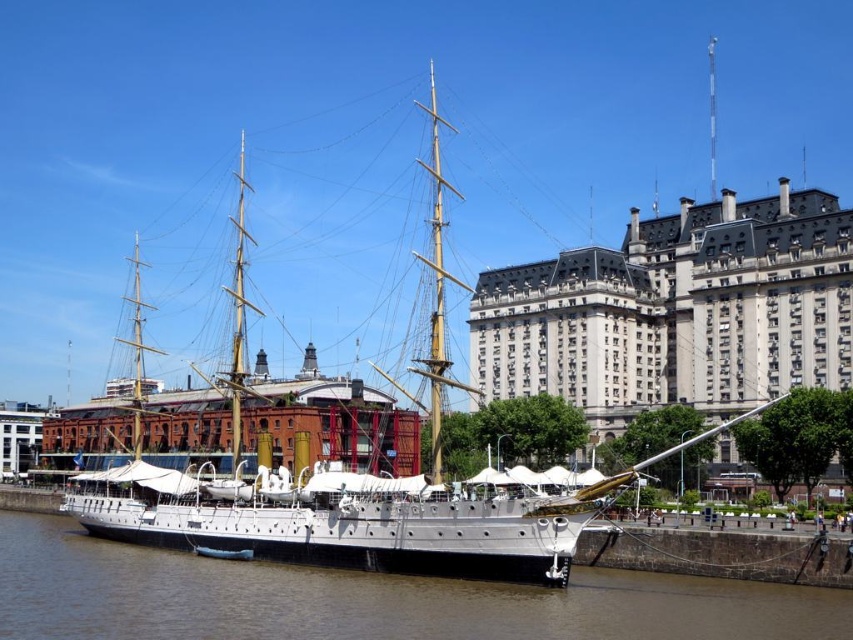
Measure the distance between white stone building at center and white polished wood ship at center.

74.82 feet

Can you confirm if white stone building at center is positioned above white polished wood ship at center?

No, white stone building at center is not above white polished wood ship at center.

Where is `white stone building at center`? white stone building at center is located at coordinates (676, 310).

Can you confirm if white stone building at center is positioned to the left of brown water at lower center?

No, white stone building at center is not to the left of brown water at lower center.

Does white stone building at center appear under brown water at lower center?

Actually, white stone building at center is above brown water at lower center.

You are a GUI agent. You are given a task and a screenshot of the screen. Output one action in this format:
    pyautogui.click(x=<x>, y=<y>)
    Task: Click on the white stone building at center
    This screenshot has height=640, width=853.
    Given the screenshot: What is the action you would take?
    pyautogui.click(x=676, y=310)

Who is more forward, [633,611] or [288,506]?

Point [633,611]

Measure the distance between brown water at lower center and white polished wood ship at center.

brown water at lower center and white polished wood ship at center are 56.08 feet apart from each other.

Where is `brown water at lower center`? The width and height of the screenshot is (853, 640). brown water at lower center is located at coordinates (366, 600).